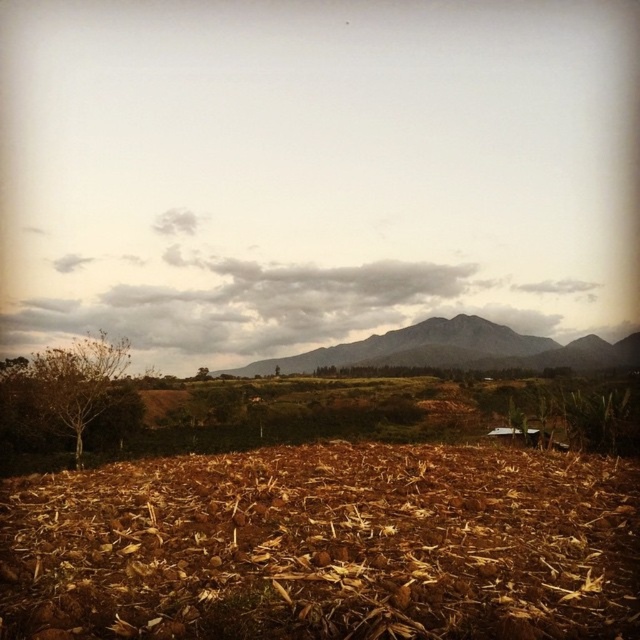
Can you confirm if gray rocky mountain at center is shorter than green leafy tree at center?

Incorrect, gray rocky mountain at center's height does not fall short of green leafy tree at center's.

Based on the photo, does gray rocky mountain at center have a smaller size compared to green leafy tree at center?

Incorrect, gray rocky mountain at center is not smaller in size than green leafy tree at center.

Between point (289, 369) and point (196, 368), which one is positioned in front?

Point (289, 369) is more forward.

Locate an element on the screen. gray rocky mountain at center is located at coordinates (452, 349).

Does brown leafy tree at left have a larger size compared to green leafy tree at center?

Indeed, brown leafy tree at left has a larger size compared to green leafy tree at center.

Who is positioned more to the right, brown leafy tree at left or green leafy tree at center?

From the viewer's perspective, brown leafy tree at left appears more on the right side.

Is point (28, 372) positioned in front of point (205, 376)?

Yes, point (28, 372) is closer to viewer.

Where is `brown leafy tree at left`? Image resolution: width=640 pixels, height=640 pixels. brown leafy tree at left is located at coordinates (67, 397).

Can you confirm if brown leafy tree at left is smaller than gray rocky mountain at center?

Correct, brown leafy tree at left occupies less space than gray rocky mountain at center.

Is point (88, 388) in front of point (532, 340)?

Yes, point (88, 388) is in front of point (532, 340).

Locate an element on the screen. brown leafy tree at left is located at coordinates (67, 397).